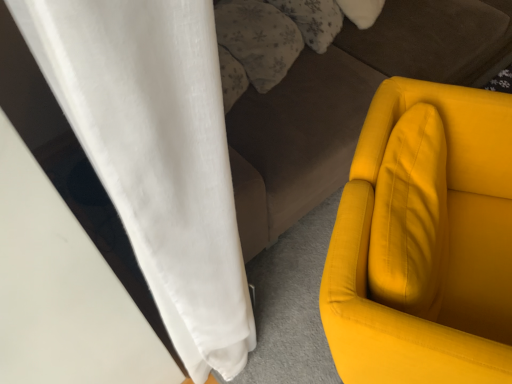
Question: From the image's perspective, is velvet brown studio couch at center beneath fluffy white pillow at upper center, which is the second pillow in left-to-right order?

Choices:
 (A) no
 (B) yes

Answer: (A)

Question: Does velvet brown studio couch at center have a greater height compared to fluffy white pillow at upper center, which is the second pillow in left-to-right order?

Choices:
 (A) yes
 (B) no

Answer: (A)

Question: Is velvet brown studio couch at center in front of fluffy white pillow at upper center, positioned as the first pillow in right-to-left order?

Choices:
 (A) yes
 (B) no

Answer: (A)

Question: Is velvet brown studio couch at center not inside fluffy white pillow at upper center, positioned as the first pillow in right-to-left order?

Choices:
 (A) no
 (B) yes

Answer: (B)

Question: From a real-world perspective, is velvet brown studio couch at center on top of fluffy white pillow at upper center, which is the second pillow in left-to-right order?

Choices:
 (A) no
 (B) yes

Answer: (A)

Question: Considering the positions of fluffy white pillow at upper center, which is the second pillow in left-to-right order, and matte yellow armchair at right in the image, is fluffy white pillow at upper center, which is the second pillow in left-to-right order, taller or shorter than matte yellow armchair at right?

Choices:
 (A) short
 (B) tall

Answer: (A)

Question: Choose the correct answer: Is fluffy white pillow at upper center, which is the second pillow in left-to-right order, inside matte yellow armchair at right or outside it?

Choices:
 (A) outside
 (B) inside

Answer: (A)

Question: Would you say fluffy white pillow at upper center, which is the second pillow in left-to-right order, is to the left or to the right of matte yellow armchair at right in the picture?

Choices:
 (A) right
 (B) left

Answer: (B)

Question: From a real-world perspective, is fluffy white pillow at upper center, which is the second pillow in left-to-right order, positioned above or below matte yellow armchair at right?

Choices:
 (A) below
 (B) above

Answer: (B)

Question: From the image's perspective, is velvet brown studio couch at center positioned above or below fluffy white pillow at upper center, positioned as the 2th pillow in right-to-left order?

Choices:
 (A) below
 (B) above

Answer: (B)

Question: Is velvet brown studio couch at center bigger or smaller than fluffy white pillow at upper center, positioned as the 2th pillow in right-to-left order?

Choices:
 (A) small
 (B) big

Answer: (B)

Question: In the image, is velvet brown studio couch at center on the left side or the right side of fluffy white pillow at upper center, positioned as the 2th pillow in right-to-left order?

Choices:
 (A) left
 (B) right

Answer: (B)

Question: From a real-world perspective, is velvet brown studio couch at center physically located above or below fluffy white pillow at upper center, the 1th pillow in the left-to-right sequence?

Choices:
 (A) above
 (B) below

Answer: (B)

Question: Looking at the image, does matte yellow armchair at right seem bigger or smaller compared to fluffy white pillow at upper center, which is the second pillow in left-to-right order?

Choices:
 (A) small
 (B) big

Answer: (B)

Question: From a real-world perspective, is matte yellow armchair at right above or below fluffy white pillow at upper center, positioned as the first pillow in right-to-left order?

Choices:
 (A) below
 (B) above

Answer: (A)